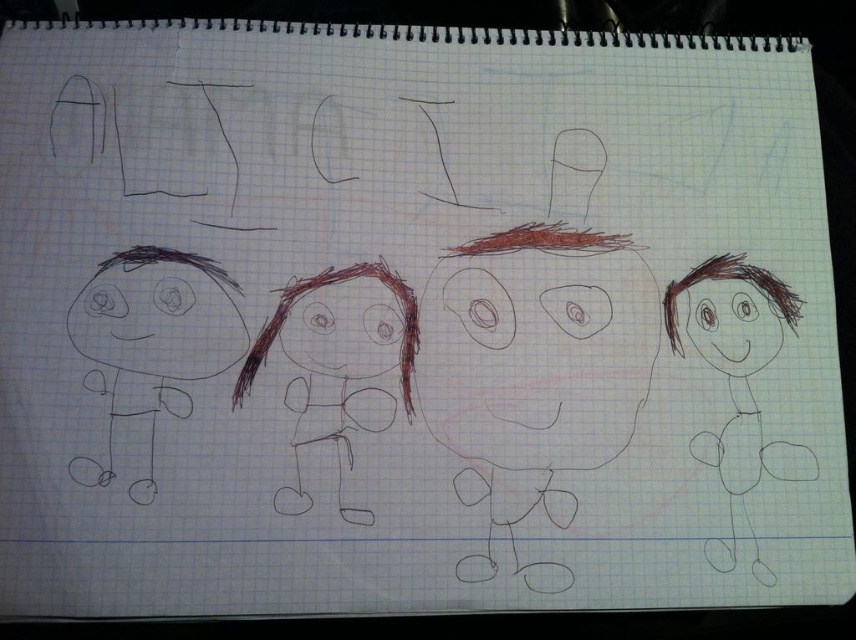
You are looking at the figure with a round head and two large eyes. Which of the two points, point (110, 440) or point (758, 292), is closer to you?

Point (110, 440) is closer to the camera than point (758, 292).

You are a teacher looking at a student drawing. The student has drawn a brown scribbled figure at left and a brown sketchy stick figure at right on the paper. Which figure is closer to the top of the page?

The brown scribbled figure at left is located above the brown sketchy stick figure at right, so it is closer to the top of the page.

Where is the brown scribbled figure at left located?

The brown scribbled figure at left is located at point 0.544 on the x axis and 0.176 on the y axis.